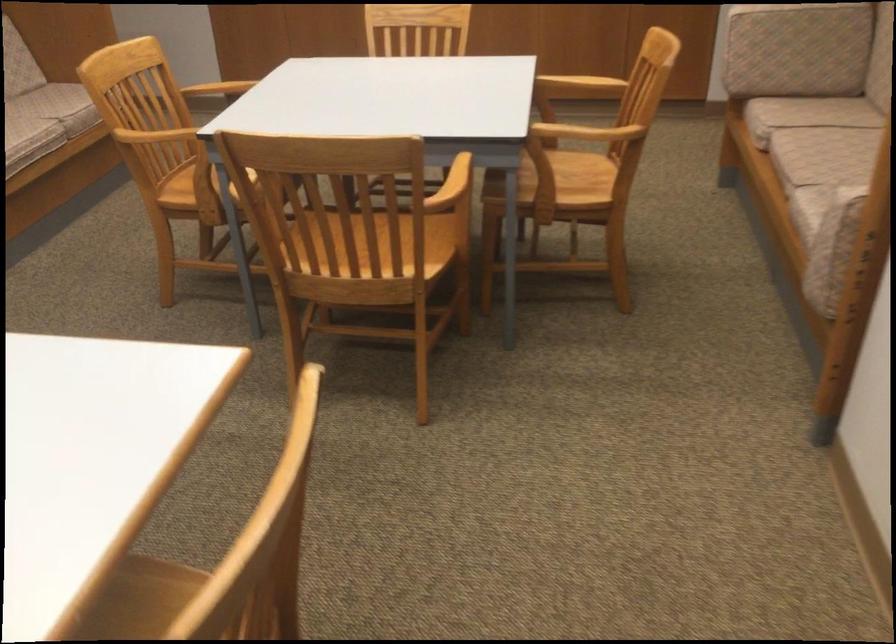
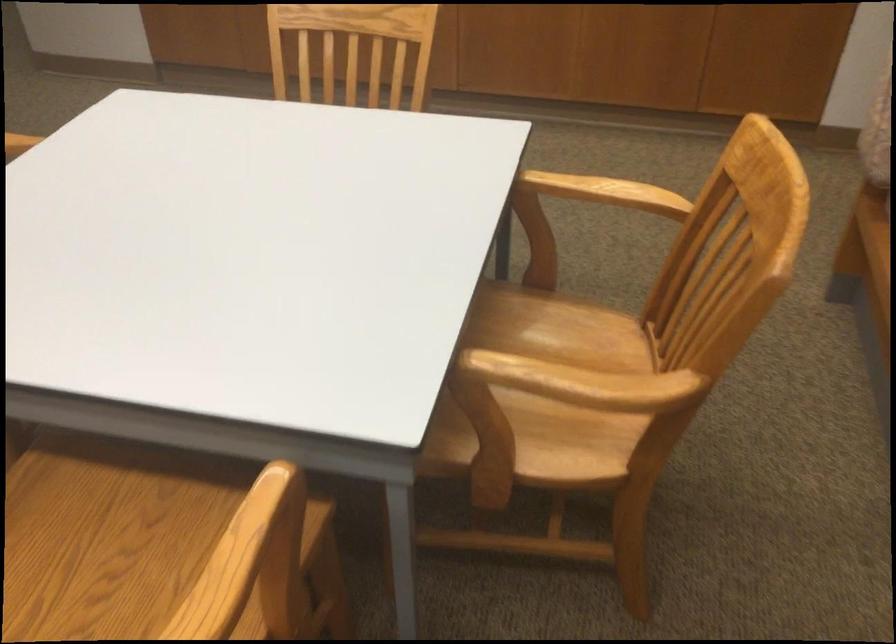
Locate, in the second image, the point that corresponds to (588,124) in the first image.

(583, 383)